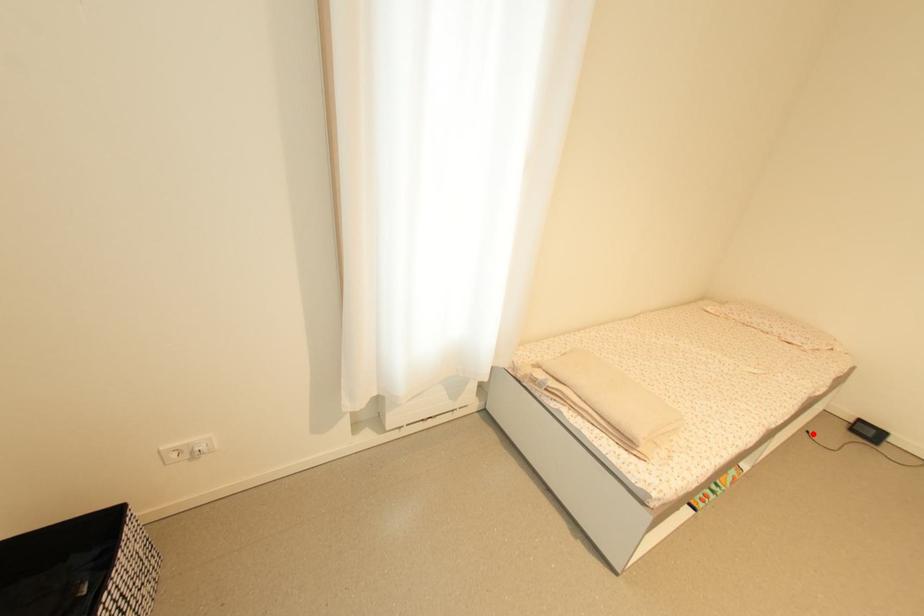
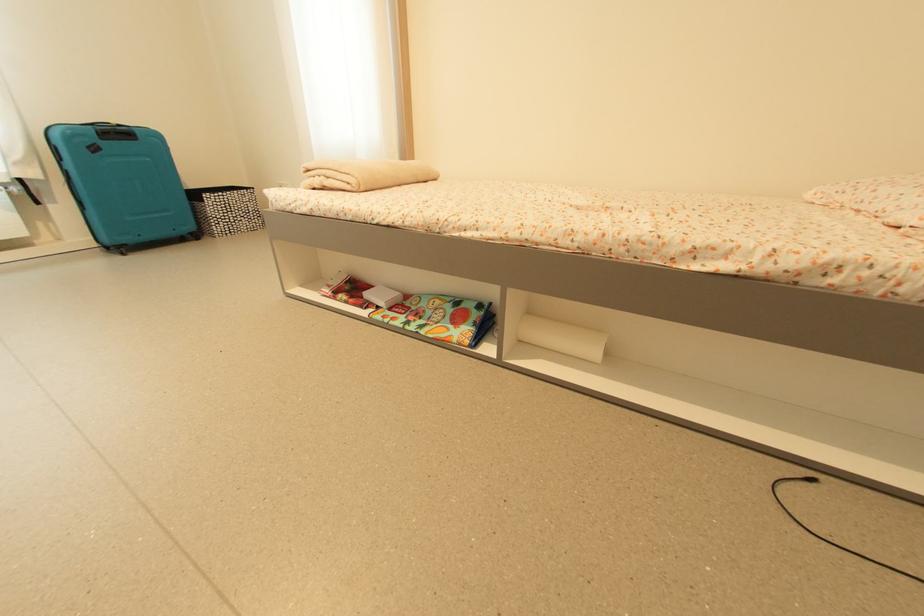
Question: A red point is marked in image1. In image2, is the corresponding 3D point closer to the camera or farther? Reply with the corresponding letter.

Choices:
 (A) The corresponding 3D point is closer.
 (B) The corresponding 3D point is farther.

Answer: (B)